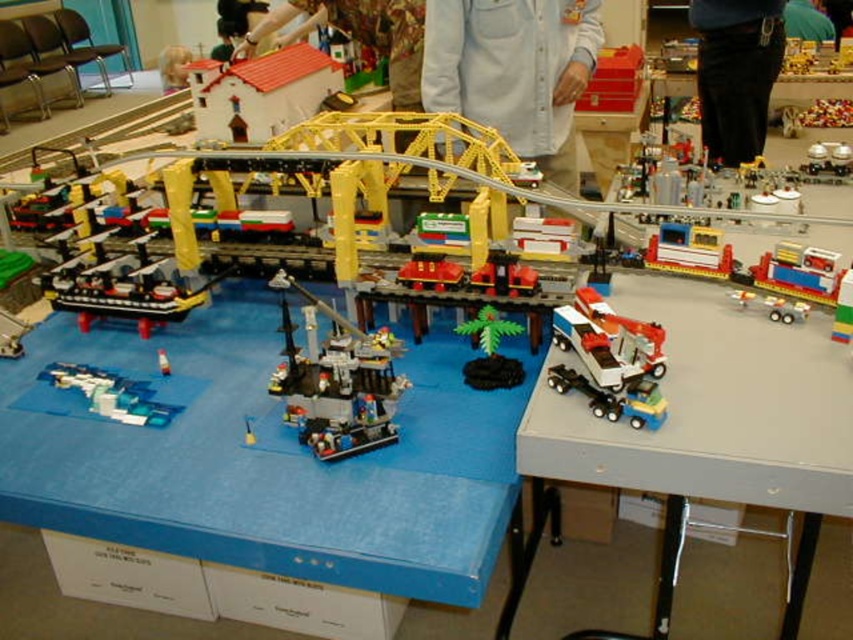
You are a photographer standing in front of the Lego diorama. You want to capture a closeup shot of the blue matte table at center. Is the table within your camera lens range if the minimum focusing distance is 0.5 meters?

The blue matte table at center is 1.03 meters away from the camera, which is within the camera lens range since the minimum focusing distance is 0.5 meters. Therefore, the photographer can capture a closeup shot of the blue matte table at center.

You are a Lego figure trying to move from the smooth white house at upper left to the blue matte table at center. Which object will you encounter first if you walk straight forward?

The blue matte table at center is larger in size compared to the smooth white house at upper left, so you will encounter the blue matte table at center first since it is closer to your path.